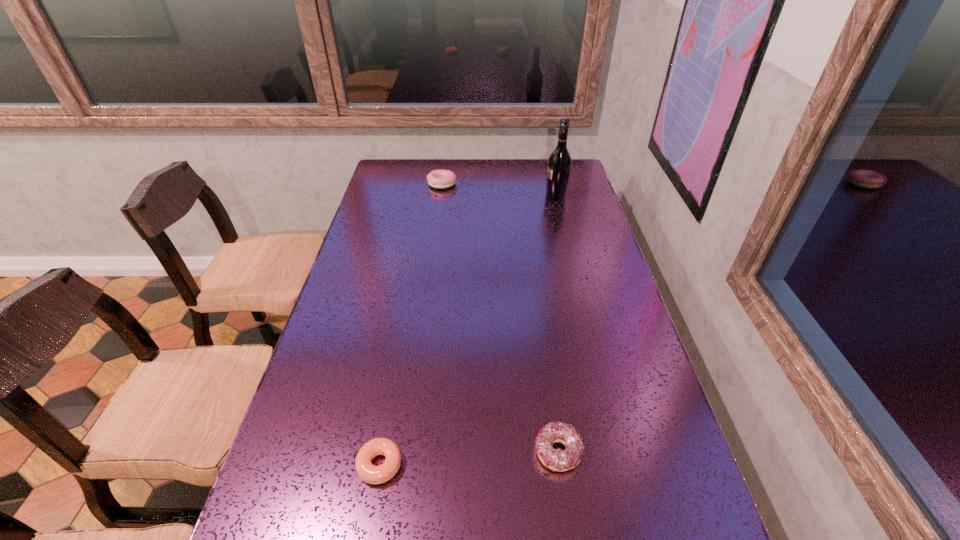
At what (x,y) coordinates should I click in order to perform the action: click on vacant region located on the right of the shortest doughnut. Please return your answer as a coordinate pair (x, y). The width and height of the screenshot is (960, 540). Looking at the image, I should click on (515, 465).

Where is `object located in the far edge section of the desktop`? object located in the far edge section of the desktop is located at coordinates (440, 179).

Identify the location of object that is at the right edge. (559, 162).

In order to click on free region at the left edge of the desktop in this screenshot , I will do `click(373, 187)`.

You are a GUI agent. You are given a task and a screenshot of the screen. Output one action in this format:
    pyautogui.click(x=<x>, y=<y>)
    Task: Click on the free space at the right edge
    The image size is (960, 540).
    Given the screenshot: What is the action you would take?
    pyautogui.click(x=609, y=260)

In order to click on vacant space at the far left corner in this screenshot , I will do `click(411, 171)`.

In the image, there is a desktop. In order to click on free space at the far right corner in this screenshot , I will do `click(576, 186)`.

Locate an element on the screen. vacant space in between the shortest doughnut and the farthest doughnut is located at coordinates (411, 325).

Locate an element on the screen. The image size is (960, 540). vacant area between the shortest doughnut and the third object from left to right is located at coordinates (469, 458).

Identify the location of empty space that is in between the third object from left to right and the farthest doughnut. This screenshot has width=960, height=540. (500, 318).